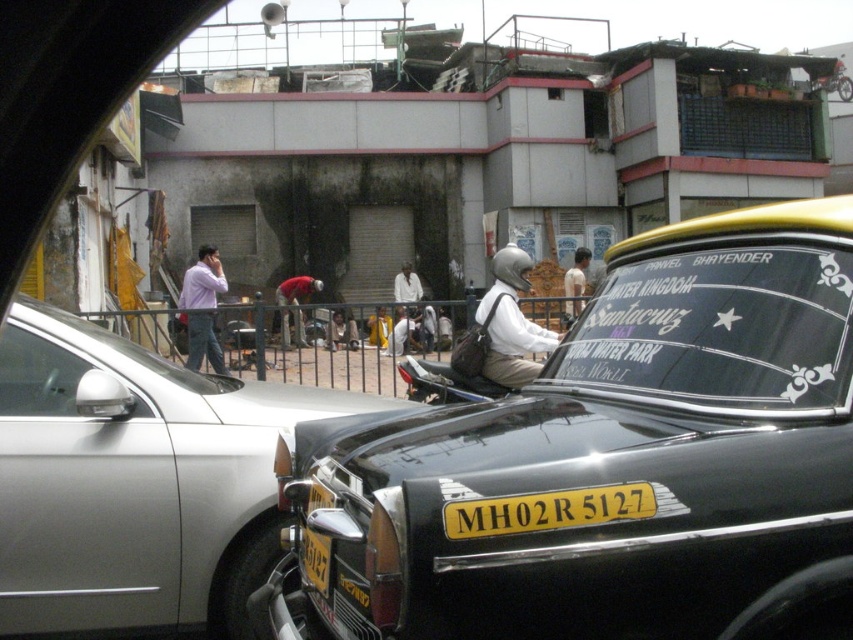
Question: Among these points, which one is nearest to the camera?

Choices:
 (A) (531, 364)
 (B) (320, 506)
 (C) (573, 285)

Answer: (B)

Question: Is matte white helmet at center below red fabric shirt at center?

Choices:
 (A) no
 (B) yes

Answer: (A)

Question: Does matte white helmet at center have a larger size compared to white matte helmet at upper center?

Choices:
 (A) yes
 (B) no

Answer: (A)

Question: Which of the following is the closest to the observer?

Choices:
 (A) black matte taxi at center
 (B) white matte shirt at center
 (C) silver metallic car at center

Answer: (A)

Question: In this image, where is light brown leather jacket at center located relative to white matte shirt at center?

Choices:
 (A) below
 (B) above

Answer: (A)

Question: Estimate the real-world distances between objects in this image. Which object is farther from the yellow metallic license plate at center?

Choices:
 (A) black matte taxi at center
 (B) light brown leather jacket at center
 (C) white matte shirt at center

Answer: (C)